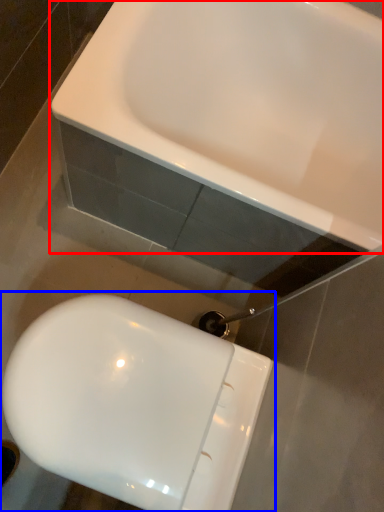
Question: Which point is further to the camera, sink (highlighted by a red box) or toilet (highlighted by a blue box)?

Choices:
 (A) sink
 (B) toilet

Answer: (A)